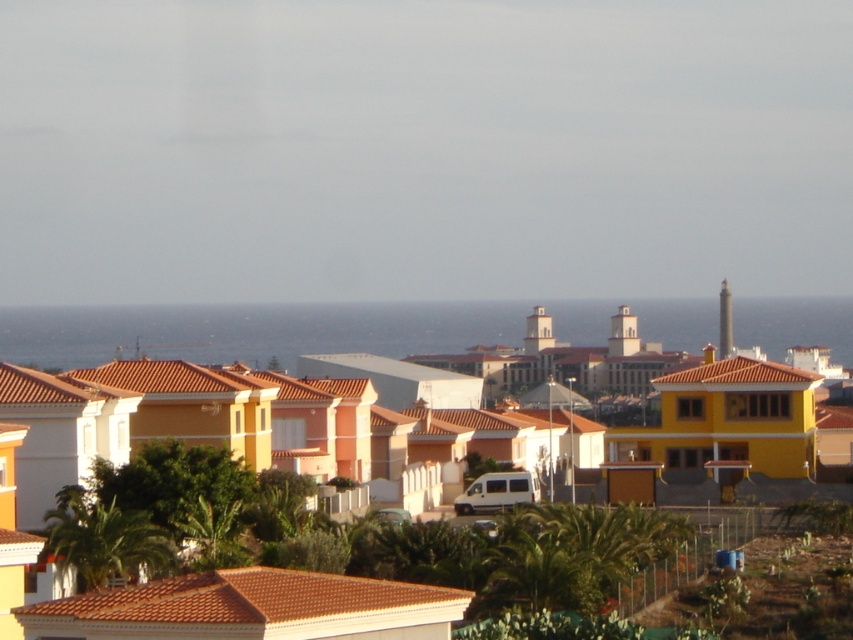
Is point (90, 573) more distant than point (177, 525)?

No.

Can you confirm if green leafy palm tree at lower left is taller than green leafy palm tree at lower center?

Indeed, green leafy palm tree at lower left has a greater height compared to green leafy palm tree at lower center.

This screenshot has width=853, height=640. Find the location of `green leafy palm tree at lower left`. green leafy palm tree at lower left is located at coordinates (103, 538).